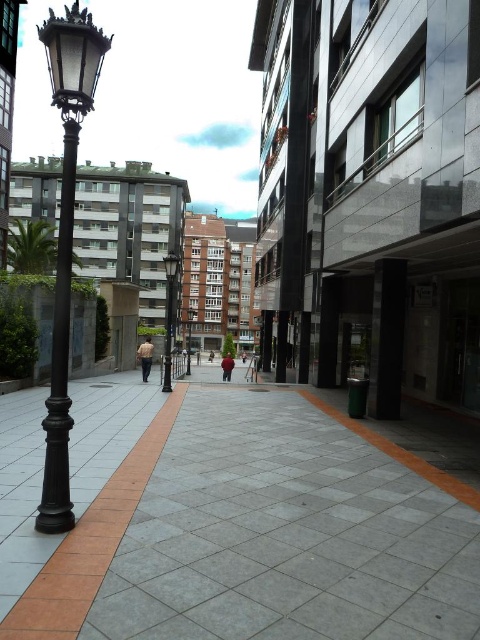
Is gray tile pavement at center to the left of matte black lamp post at left from the viewer's perspective?

No, gray tile pavement at center is not to the left of matte black lamp post at left.

Between gray tile pavement at center and matte black lamp post at left, which one has more height?

Standing taller between the two is matte black lamp post at left.

Identify the location of gray tile pavement at center. Image resolution: width=480 pixels, height=640 pixels. (229, 522).

Who is more forward, (231, 358) or (208, 356)?

Point (231, 358) is in front.

Who is positioned more to the right, red cotton shirt at center or dark blue jeans at center?

red cotton shirt at center

Locate an element on the screen. The height and width of the screenshot is (640, 480). red cotton shirt at center is located at coordinates (227, 365).

Who is lower down, polished brass street light at center or dark blue jeans at center?

dark blue jeans at center is lower down.

Does polished brass street light at center lie in front of dark blue jeans at center?

That is True.

Does point (166, 260) come behind point (210, 360)?

No, it is not.

At what (x,y) coordinates should I click in order to perform the action: click on polished brass street light at center. Please return your answer as a coordinate pair (x, y). The width and height of the screenshot is (480, 640). Looking at the image, I should click on (168, 316).